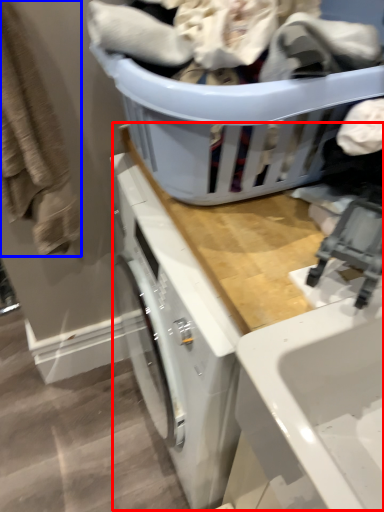
Question: Among these objects, which one is nearest to the camera, counter top (highlighted by a red box) or clothing (highlighted by a blue box)?

Choices:
 (A) counter top
 (B) clothing

Answer: (A)